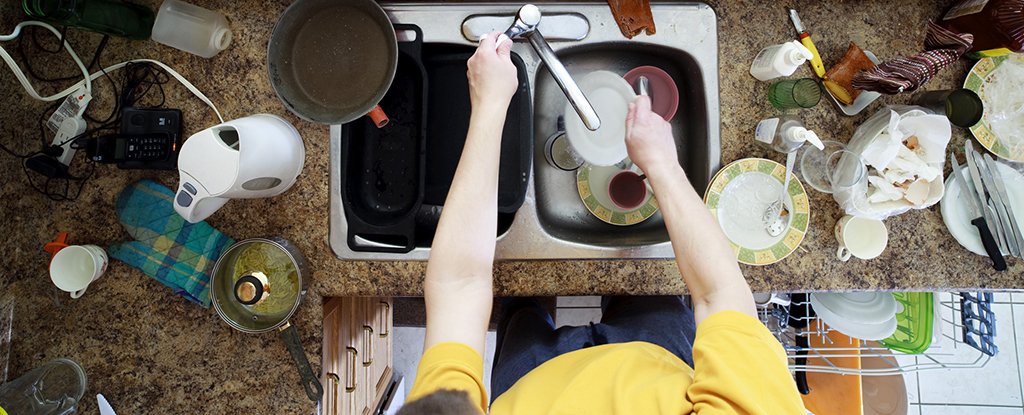
Find the location of a particular element. This screenshot has height=415, width=1024. sink is located at coordinates (522, 240), (564, 193).